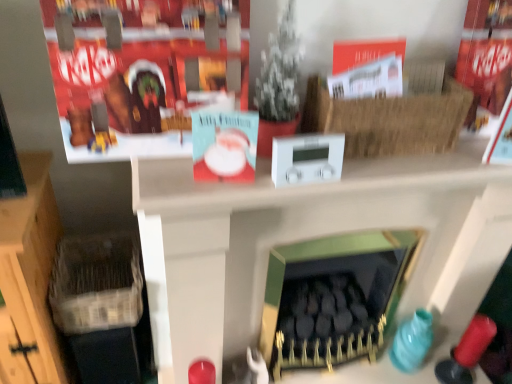
Question: From the image's perspective, is green matte fireplace at center positioned above or below braided straw basket at upper right, the 2th basket positioned from the bottom?

Choices:
 (A) below
 (B) above

Answer: (A)

Question: Is green matte fireplace at center spatially inside braided straw basket at upper right, the second basket viewed from the back, or outside of it?

Choices:
 (A) outside
 (B) inside

Answer: (A)

Question: Estimate the real-world distances between objects in this image. Which object is closer to the green matte fireplace at center?

Choices:
 (A) red cardboard box at upper left
 (B) white plastic thermostat at center
 (C) wooden crate at left
 (D) green matte fireplace at center
 (E) woven wicker basket at lower left, acting as the first basket starting from the left

Answer: (D)

Question: Based on their relative distances, which object is farther from the white plastic thermostat at center?

Choices:
 (A) green matte fireplace at center
 (B) green matte fireplace at center
 (C) teal glossy vase at lower right
 (D) wooden crate at left
 (E) braided straw basket at upper right, the second basket viewed from the back

Answer: (C)